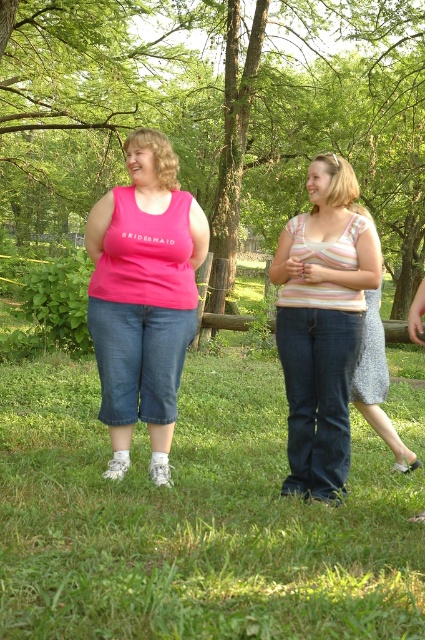
Question: Does green leafy tree at upper center appear over matte pink tank top at center?

Choices:
 (A) yes
 (B) no

Answer: (A)

Question: Considering the real-world distances, which object is closest to the striped cotton tank top at center?

Choices:
 (A) matte pink tank top at center
 (B) speckled fabric dress at center

Answer: (B)

Question: Estimate the real-world distances between objects in this image. Which object is farther from the green leafy tree at upper center?

Choices:
 (A) speckled fabric dress at center
 (B) matte pink tank top at center
 (C) striped cotton tank top at center

Answer: (A)

Question: Observing the image, what is the correct spatial positioning of matte pink tank top at center in reference to striped cotton tank top at center?

Choices:
 (A) below
 (B) above

Answer: (B)

Question: Is the position of striped cotton tank top at center less distant than that of speckled fabric dress at center?

Choices:
 (A) yes
 (B) no

Answer: (A)

Question: Which of the following is the farthest from the observer?

Choices:
 (A) green leafy tree at upper center
 (B) striped cotton tank top at center
 (C) matte pink tank top at center
 (D) speckled fabric dress at center

Answer: (A)